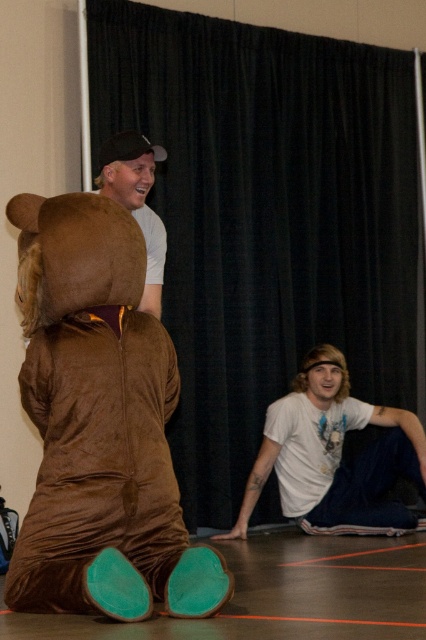
You are a stagehand setting up for a play. You have to hang a large banner that requires 3 meters of space. The banner must be placed behind either the black velvet curtain at upper center or the brown velvety bear at center. Based on their sizes, which object can accommodate the banner?

The black velvet curtain at upper center is bigger than the brown velvety bear at center, so the banner should be placed behind the black velvet curtain at upper center as it has enough space.

You are a photographer who needs to position a spotlight on the brown velvety bear at center. According to the coordinates provided, where should you aim the spotlight?

The brown velvety bear at center is located at the 2D coordinates point (100,424), so you should aim the spotlight at that exact point to illuminate it properly.

You are a photographer setting up for a photo shoot. You need to position a camera so that both the brown velvety bear at center and the matte brown bear at upper left are visible in the frame. Based on their positions, which bear should you place closer to the left edge of the camera frame?

The brown velvety bear at center should be placed closer to the left edge of the camera frame because it is positioned on the left side of the matte brown bear at upper left.